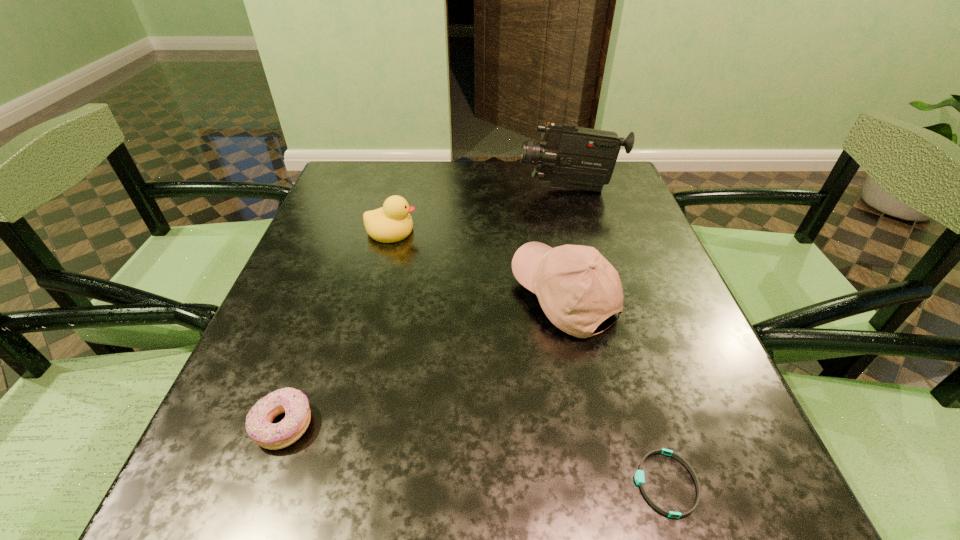
Find the location of a particular element. vacant space that's between the wristband and the second shortest object is located at coordinates (474, 455).

This screenshot has height=540, width=960. What are the coordinates of `empty location between the wristband and the third nearest object` in the screenshot? It's located at (614, 390).

Identify the location of vacant space that's between the doughnut and the third farthest object. The width and height of the screenshot is (960, 540). (423, 361).

In order to click on vacant space that's between the wristband and the tallest object in this screenshot , I will do `click(617, 336)`.

Locate an element on the screen. The height and width of the screenshot is (540, 960). the second closest object to the fourth nearest object is located at coordinates (572, 157).

Image resolution: width=960 pixels, height=540 pixels. I want to click on object that is the fourth nearest to the shortest object, so click(572, 157).

Where is `free point that satisfies the following two spatial constraints: 1. on the front-facing side of the tallest object; 2. on the front side of the second shortest object`? The height and width of the screenshot is (540, 960). free point that satisfies the following two spatial constraints: 1. on the front-facing side of the tallest object; 2. on the front side of the second shortest object is located at coordinates (637, 426).